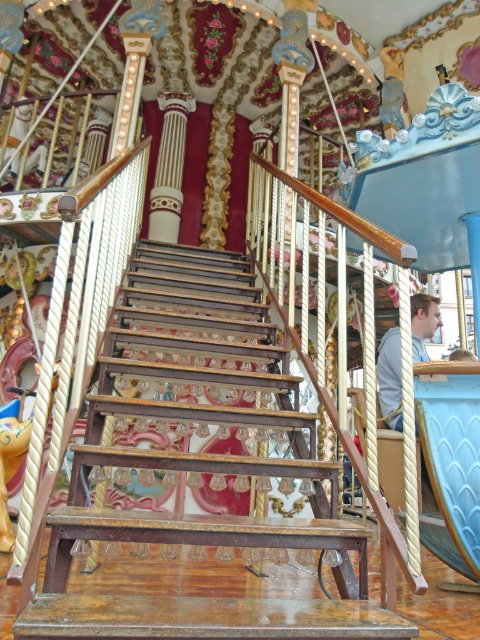
Question: Which of the following is the farthest from the observer?

Choices:
 (A) light blue shirt at center
 (B) wooden stairs at center

Answer: (A)

Question: Does wooden stairs at center appear on the right side of light blue shirt at center?

Choices:
 (A) no
 (B) yes

Answer: (A)

Question: Is wooden stairs at center smaller than light blue shirt at center?

Choices:
 (A) no
 (B) yes

Answer: (A)

Question: Where is wooden stairs at center located in relation to light blue shirt at center in the image?

Choices:
 (A) below
 (B) above

Answer: (A)